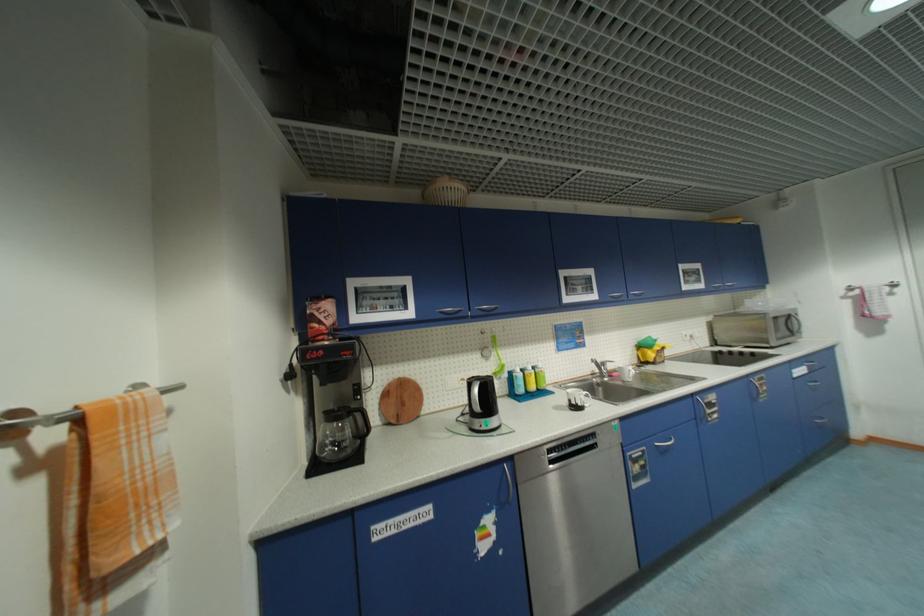
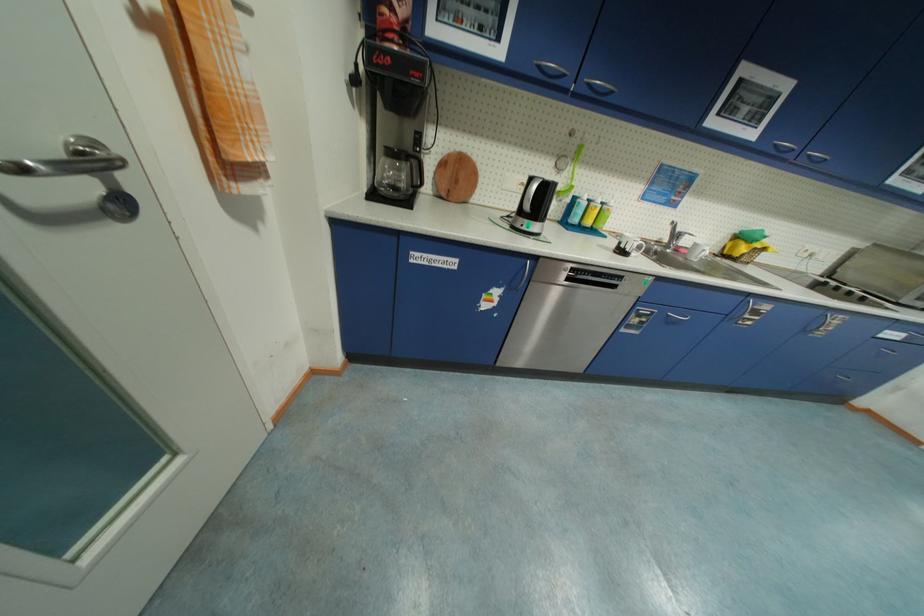
Find the pixel in the second image that matches (520,376) in the first image.

(584, 201)